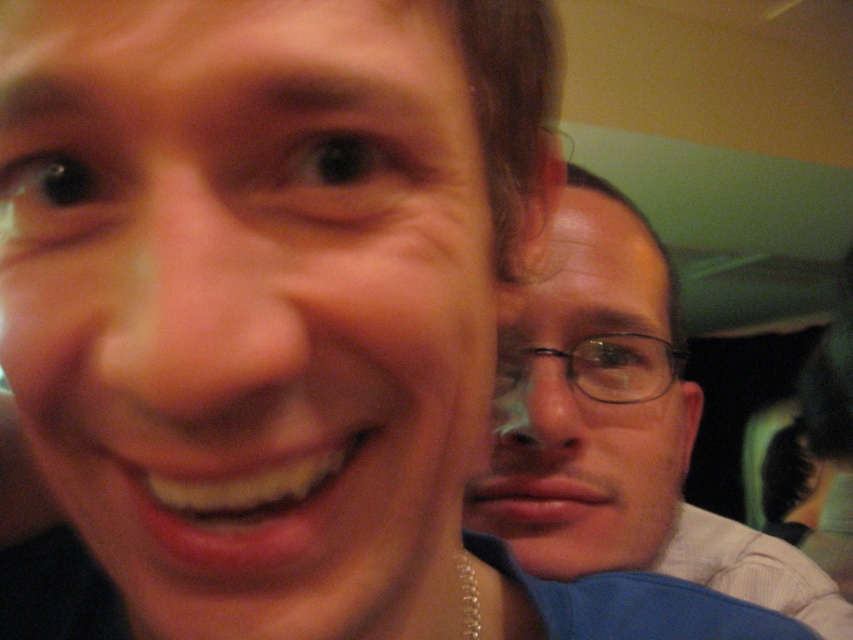
You are taking a photo and want to ensure both the matte skin at center and the matte black glasses at upper right are in focus. Which object should you adjust your focus on first to ensure clarity?

The matte skin at center is closer to the viewer than the matte black glasses at upper right. To ensure both are in focus, you should adjust your focus on the matte skin at center first, as it is closer, and then check the matte black glasses at upper right.

You are a photographer trying to decide which pair of glasses to use for a portrait. You have the matte black glasses at center and the black plastic glasses at right. Which pair has a wider frame?

The matte black glasses at center has a larger width than the black plastic glasses at right, so the matte black glasses at center has a wider frame.

You are a photographer trying to adjust the lighting for a portrait. You notice two elements in the image, matte skin at center and matte black glasses at upper right. Which of these elements should you focus on if you want to ensure proper exposure, considering their sizes?

The matte skin at center has a smaller size compared to matte black glasses at upper right. Since the matte skin at center is smaller, you should focus on it to ensure proper exposure as smaller areas may require more precise lighting adjustments.